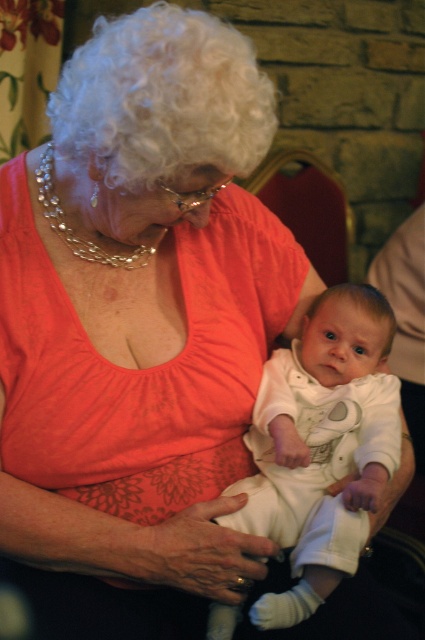
You are a photographer setting up for a family photo. You need to ensure that the white cotton onesie at center and the white curly wig at upper left are within a 20 inch frame. Can both objects fit within the frame?

The distance between the white cotton onesie at center and the white curly wig at upper left is 19.27 inches, which is less than 20 inches. Therefore, both objects can fit within the frame.

You are a photographer setting up a shoot. You have a velvet red chair at center and a blonde hair wig at center in your scene. Based on the scene description, which object is positioned higher from the ground?

The velvet red chair at center is located above blonde hair wig at center, so the velvet red chair at center is positioned higher from the ground.

You are a photographer setting up for a family portrait. You see the velvet red chair at center and the blonde hair wig at center in the scene. Which object should you adjust first to ensure the elderly woman and baby are at eye level with the camera?

The velvet red chair at center is much taller than the blonde hair wig at center. To bring the elderly woman and baby to eye level, you should lower the height of the velvet red chair at center first since it is the taller object.